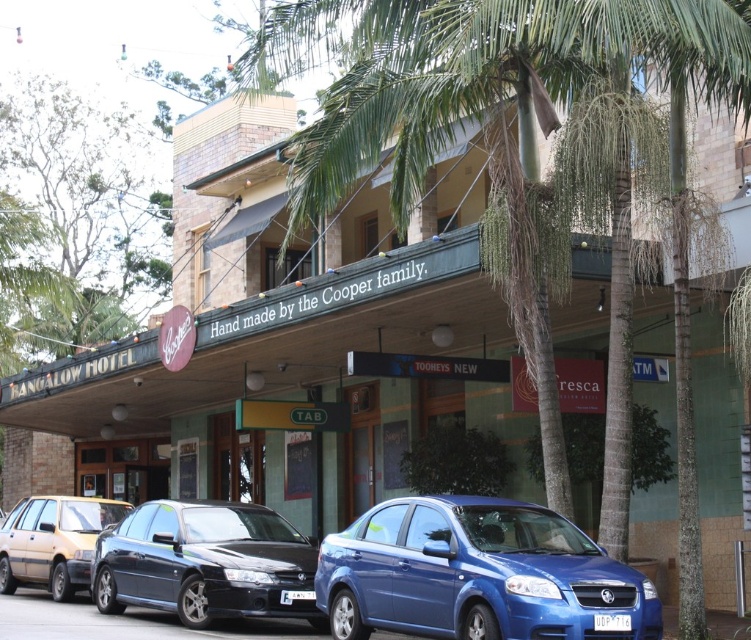
Is green leafy palm tree at center further to camera compared to glossy blue sedan at lower center?

Yes, green leafy palm tree at center is further from the viewer.

Who is taller, green leafy palm tree at center or glossy blue sedan at lower center?

green leafy palm tree at center

Which is behind, point (716, 60) or point (330, 554)?

Point (330, 554)

Find the location of a particular element. green leafy palm tree at center is located at coordinates (501, 144).

Is point (740, 1) closer to viewer compared to point (77, 554)?

That is True.

Looking at this image, who is more forward, (x=374, y=17) or (x=44, y=554)?

Positioned in front is point (x=374, y=17).

This screenshot has height=640, width=751. I want to click on green leafy palm tree at center, so click(501, 144).

Between point (23, 566) and point (300, 593), which one is positioned in front?

Point (300, 593)

Who is more distant from viewer, (x=32, y=554) or (x=285, y=593)?

Positioned behind is point (x=32, y=554).

This screenshot has width=751, height=640. What do you see at coordinates (56, 541) in the screenshot? I see `matte beige sedan at lower left` at bounding box center [56, 541].

You are a GUI agent. You are given a task and a screenshot of the screen. Output one action in this format:
    pyautogui.click(x=<x>, y=<y>)
    Task: Click on the matte beige sedan at lower left
    
    Given the screenshot: What is the action you would take?
    pyautogui.click(x=56, y=541)